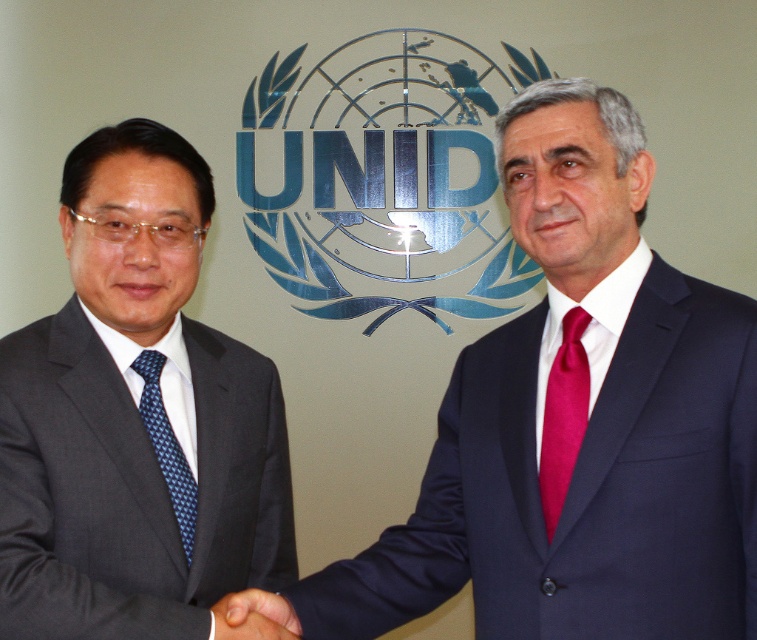
Question: Can you confirm if navy blue suit at center is bigger than blue dotted tie at left?

Choices:
 (A) yes
 (B) no

Answer: (A)

Question: Which object is closer to the camera taking this photo?

Choices:
 (A) blue dotted tie at left
 (B) matte black suit at left
 (C) black matte hand at center

Answer: (B)

Question: Can you confirm if matte black suit at left is positioned above shiny red tie at right?

Choices:
 (A) no
 (B) yes

Answer: (B)

Question: Is shiny red tie at right above blue dotted tie at left?

Choices:
 (A) yes
 (B) no

Answer: (A)

Question: Which object is closer to the camera taking this photo?

Choices:
 (A) blue dotted tie at left
 (B) matte black suit at left

Answer: (B)

Question: Which of the following is the closest to the observer?

Choices:
 (A) black matte hand at center
 (B) matte black suit at left
 (C) shiny red tie at right
 (D) blue dotted tie at left

Answer: (B)